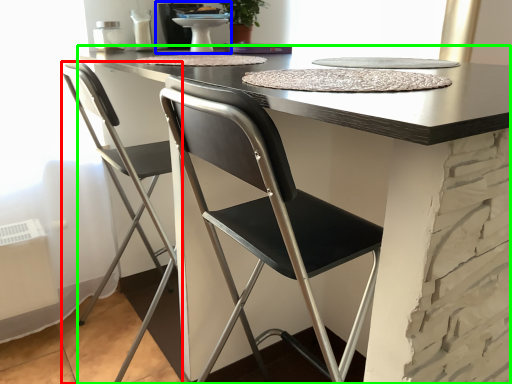
Question: Which object is the farthest from chair (highlighted by a red box)? Choose among these: sink (highlighted by a blue box) or table (highlighted by a green box).

Choices:
 (A) sink
 (B) table

Answer: (B)